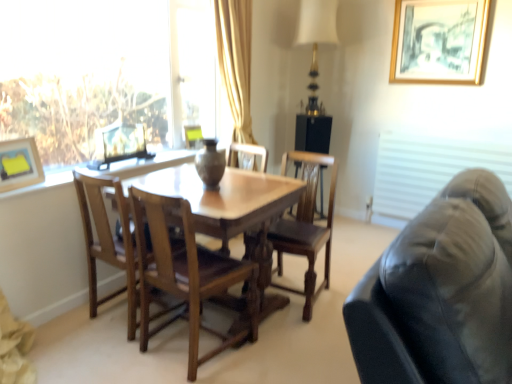
I want to click on free space in front of matte brown vase at center, so click(215, 190).